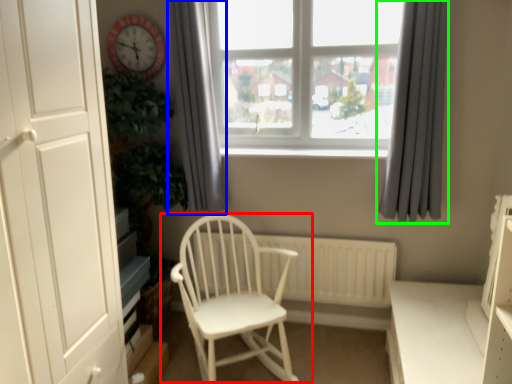
Question: Which object is the farthest from chair (highlighted by a red box)? Choose among these: curtain (highlighted by a blue box) or curtain (highlighted by a green box).

Choices:
 (A) curtain
 (B) curtain

Answer: (B)